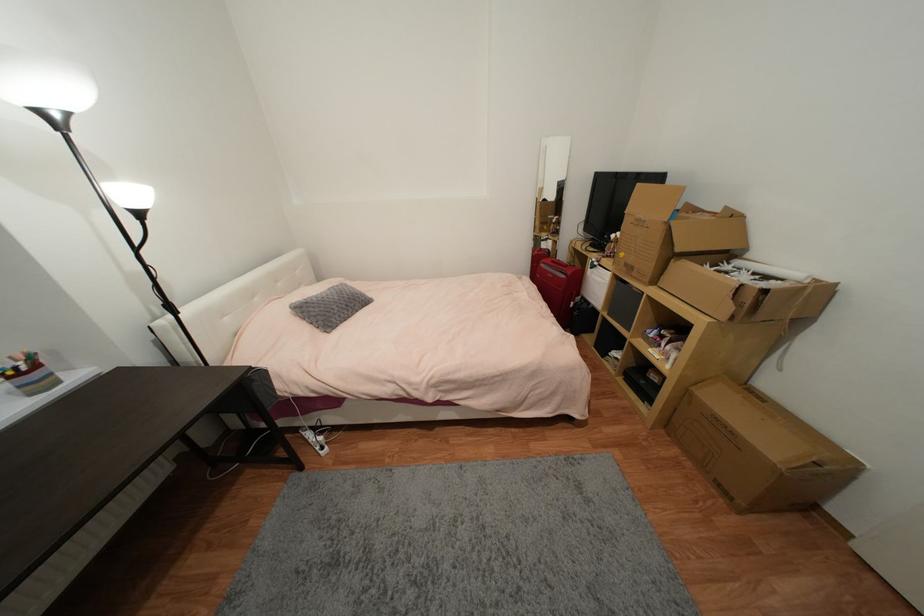
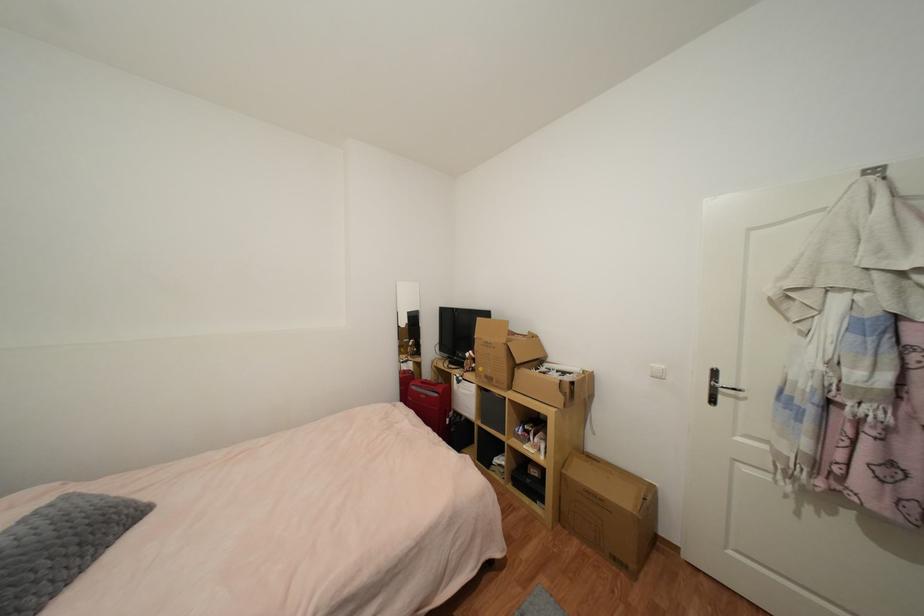
In the second image, find the point that corresponds to [600,265] in the first image.

(465, 379)